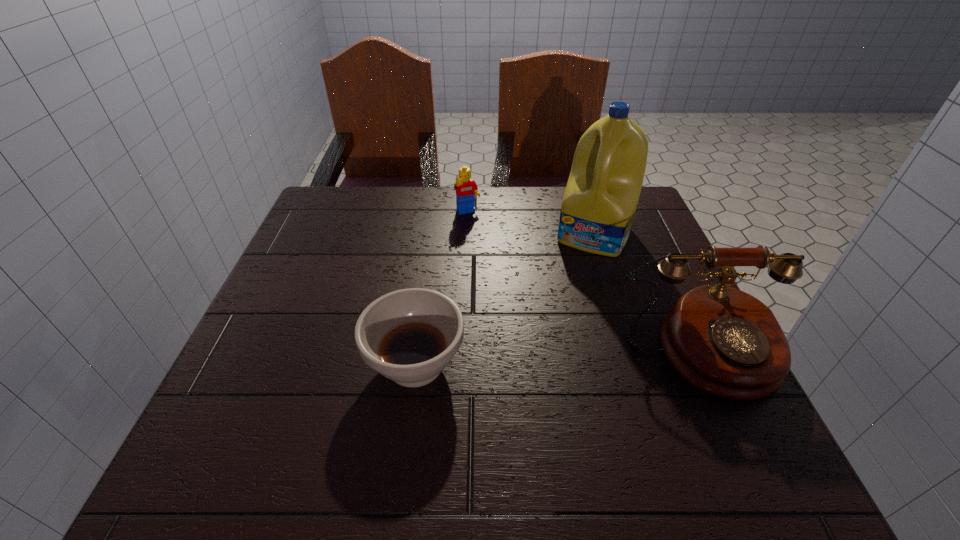
This screenshot has width=960, height=540. I want to click on soup bowl, so click(x=409, y=336).

I want to click on the second tallest object, so click(x=725, y=342).

Where is `detergent`? This screenshot has width=960, height=540. detergent is located at coordinates (599, 204).

Find the location of `Lego`. Lego is located at coordinates (466, 188).

Locate an element on the screen. vacant space located 0.100m on the back of the soup bowl is located at coordinates (425, 293).

Identify the location of free spot located on the label of the tallest object. (557, 318).

I want to click on free space located on the label of the tallest object, so click(x=564, y=299).

I want to click on vacant space positioned on the label of the tallest object, so click(x=534, y=369).

Where is `vacant space located 0.140m on the face of the third tallest object`? The height and width of the screenshot is (540, 960). vacant space located 0.140m on the face of the third tallest object is located at coordinates (491, 251).

Identify the location of vacant space positioned on the face of the third tallest object. The height and width of the screenshot is (540, 960). (519, 300).